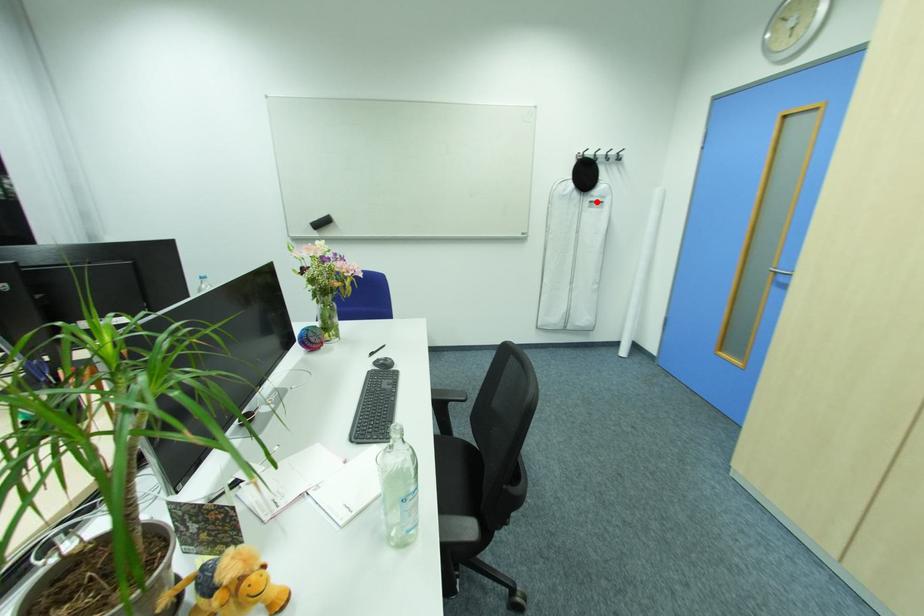
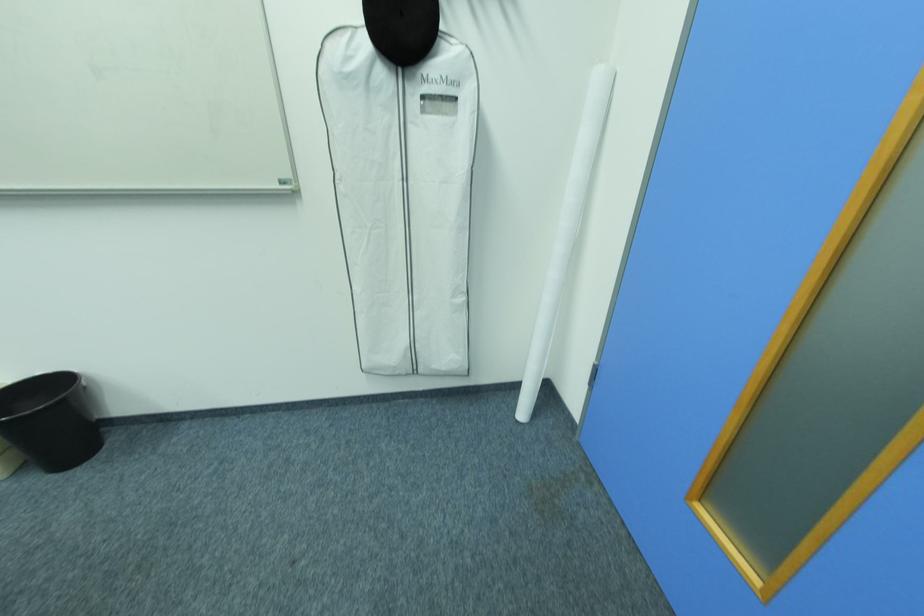
Find the pixel in the second image that matches the highlighted location in the first image.

(428, 98)